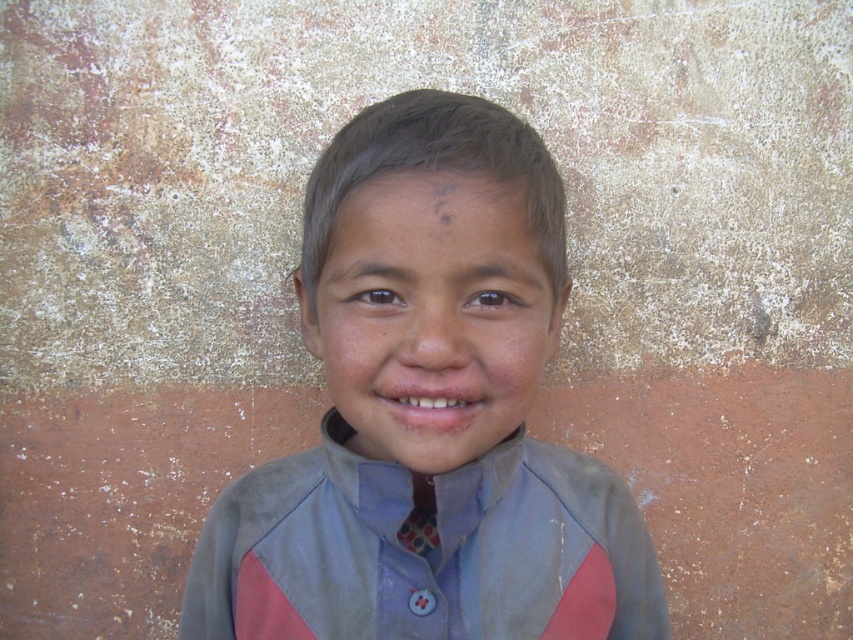
Between gray cotton jacket at center and smooth skin face at center, which one has more height?

gray cotton jacket at center

Is gray cotton jacket at center above smooth skin face at center?

Actually, gray cotton jacket at center is below smooth skin face at center.

Does point (364, 577) lie behind point (370, 428)?

Yes, it is behind point (370, 428).

Locate an element on the screen. gray cotton jacket at center is located at coordinates (428, 554).

Is point (341, 209) behind point (434, 538)?

No.

What are the coordinates of `smooth skin face at center` in the screenshot? It's located at (431, 316).

Between point (532, 364) and point (421, 531), which one is positioned in front?

Point (532, 364)

This screenshot has width=853, height=640. In order to click on smooth skin face at center in this screenshot , I will do `click(431, 316)`.

Does point (398, 148) come in front of point (509, 259)?

Yes, it is.

Who is positioned more to the right, matte gray shirt at center or smooth skin face at center?

From the viewer's perspective, smooth skin face at center appears more on the right side.

Is point (614, 550) farther from camera compared to point (440, 321)?

That is True.

Locate an element on the screen. The width and height of the screenshot is (853, 640). matte gray shirt at center is located at coordinates (427, 429).